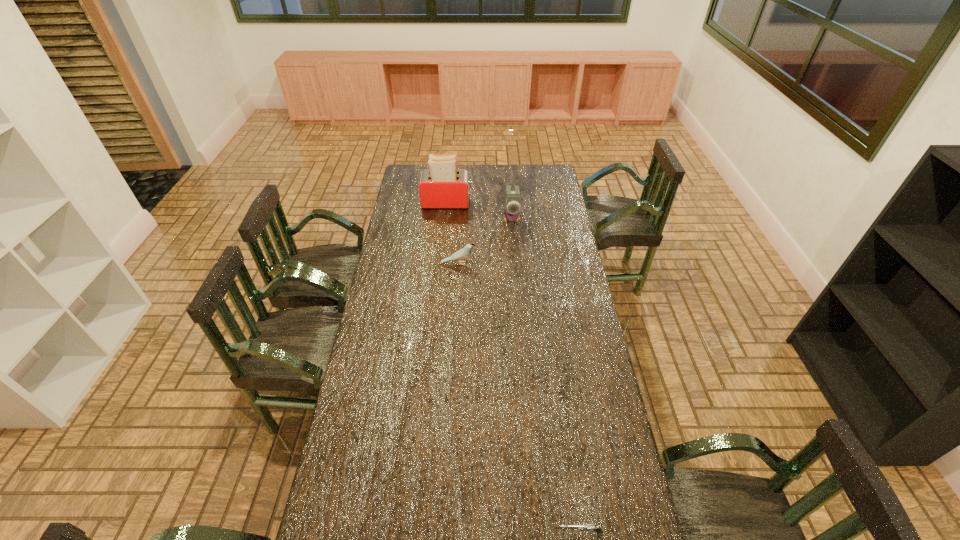
Identify the location of free space between the tallest object and the left bird. (453, 233).

Identify the location of vacant point located between the shorter bird and the tallest object. (453, 233).

This screenshot has height=540, width=960. I want to click on free spot between the third tallest object and the tallest object, so click(x=453, y=233).

Find the location of `vacant space in between the third farthest object and the tallest object`. vacant space in between the third farthest object and the tallest object is located at coordinates (453, 233).

Find the location of a particular element. free area in between the second shortest object and the shortest object is located at coordinates (519, 397).

Where is `vacant area that lies between the left bird and the taller bird`? Image resolution: width=960 pixels, height=540 pixels. vacant area that lies between the left bird and the taller bird is located at coordinates (485, 241).

Locate an element on the screen. The image size is (960, 540). empty location between the tallest object and the shorter bird is located at coordinates (453, 233).

The image size is (960, 540). I want to click on free point between the right bird and the tallest object, so tap(479, 211).

This screenshot has width=960, height=540. In order to click on object that is the third closest to the toaster in this screenshot , I will do `click(590, 527)`.

Identify the location of the third closest object to the left bird. The height and width of the screenshot is (540, 960). (590, 527).